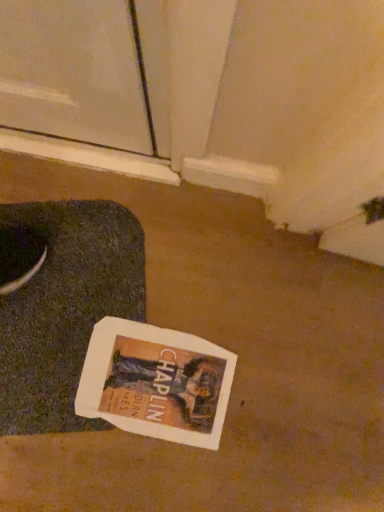
What are the coordinates of `free spot above white paper magazine at center (from a real-world perspective)` in the screenshot? It's located at click(x=152, y=380).